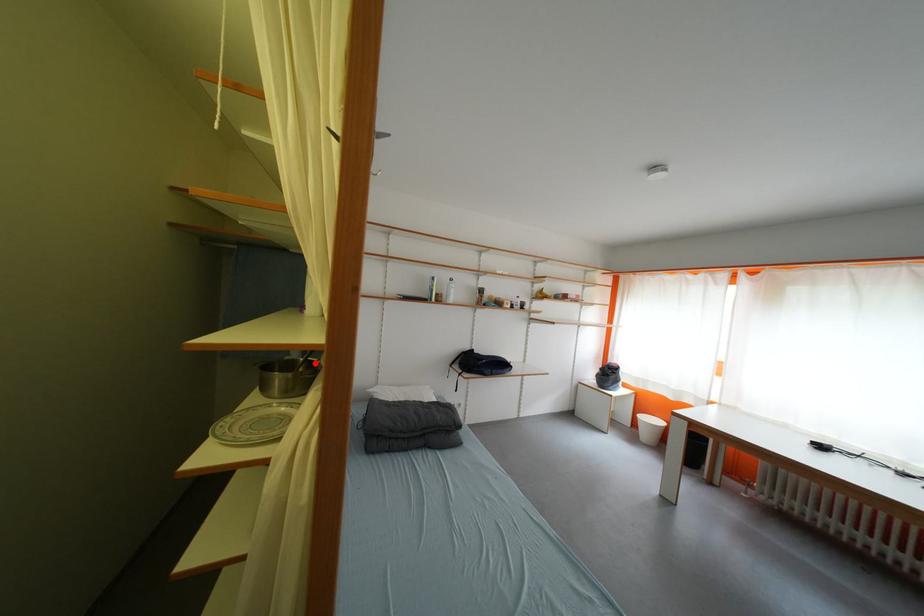
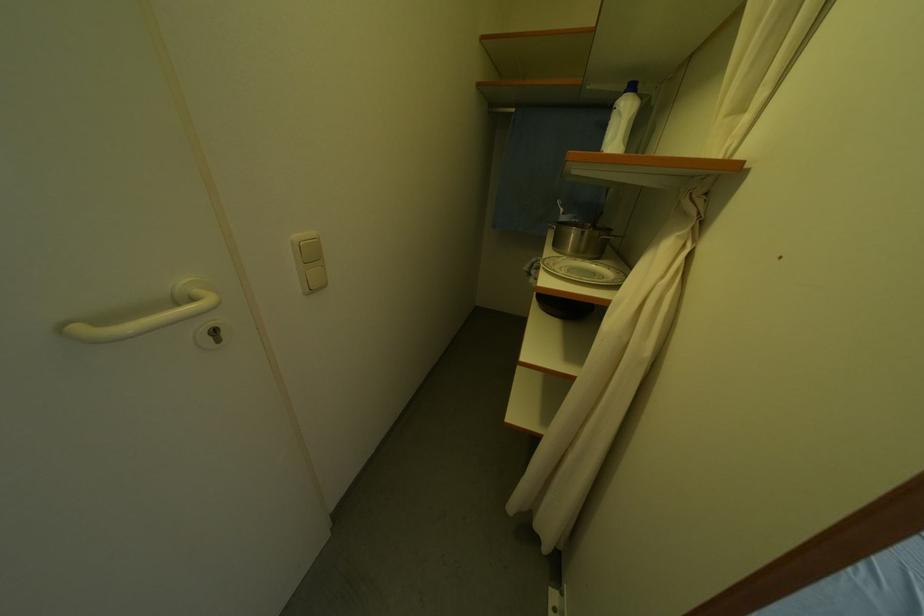
Question: I am providing you with two images of the same scene from different viewpoints. In image1, a red point is highlighted. Considering the same 3D point in image2, which of the following is correct?

Choices:
 (A) It is closer
 (B) It is farther

Answer: (A)